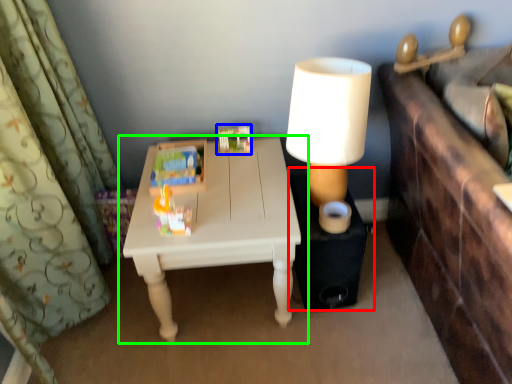
Question: Which object is the farthest from side table (highlighted by a red box)? Choose among these: toy (highlighted by a blue box) or table (highlighted by a green box).

Choices:
 (A) toy
 (B) table

Answer: (A)